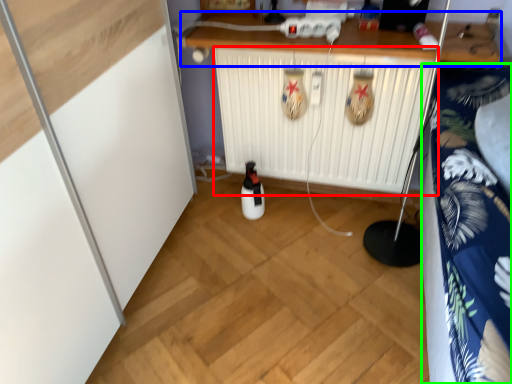
Question: Which object is positioned farthest from radiator (highlighted by a red box)? Select from counter (highlighted by a blue box) and bedding (highlighted by a green box).

Choices:
 (A) counter
 (B) bedding

Answer: (B)